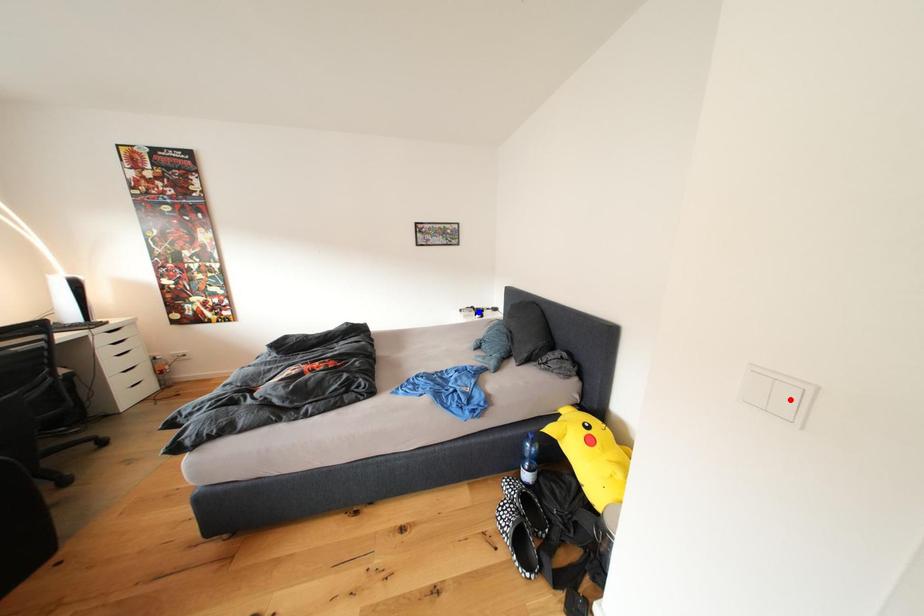
Question: Which of the two points in the image is closer to the camera?

Choices:
 (A) Blue point is closer.
 (B) Red point is closer.

Answer: (B)